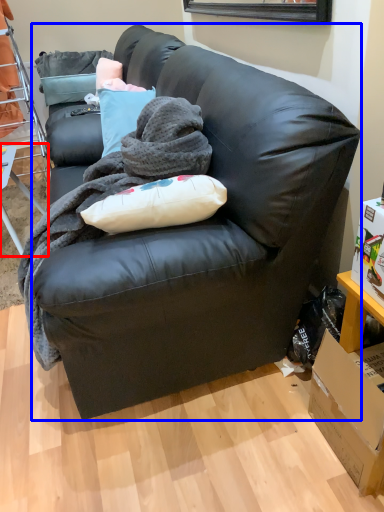
Question: Which object appears farthest to the camera in this image, table (highlighted by a red box) or studio couch (highlighted by a blue box)?

Choices:
 (A) table
 (B) studio couch

Answer: (A)